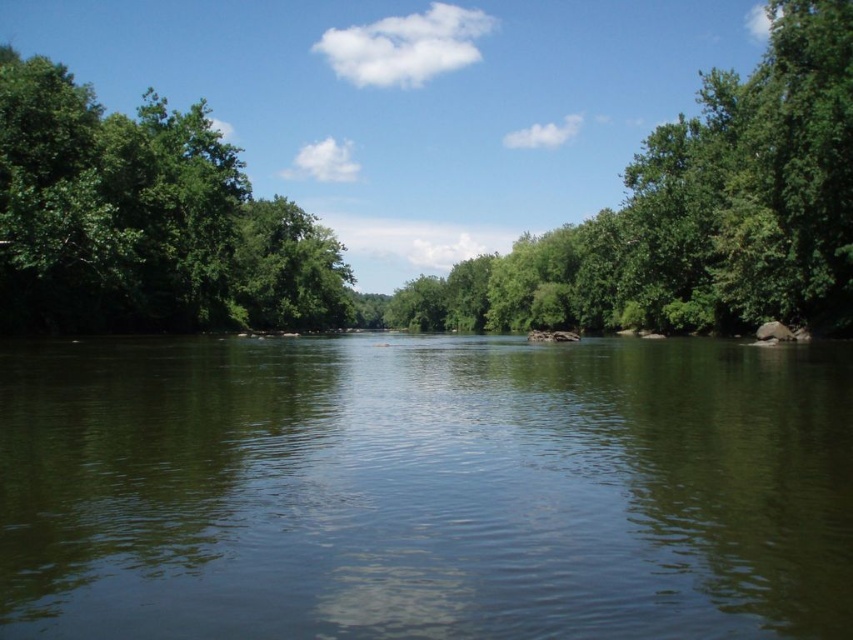
You are standing on the riverbank and see the green leafy tree at center and the green leafy tree at left. Which tree is taller?

The green leafy tree at center is taller than the green leafy tree at left according to the description.

You are standing on the riverbank and see the green leafy tree at center and the green leafy tree at left. Which tree would appear larger to you?

The green leafy tree at center is closer to the viewer, so it would appear larger than the green leafy tree at left.